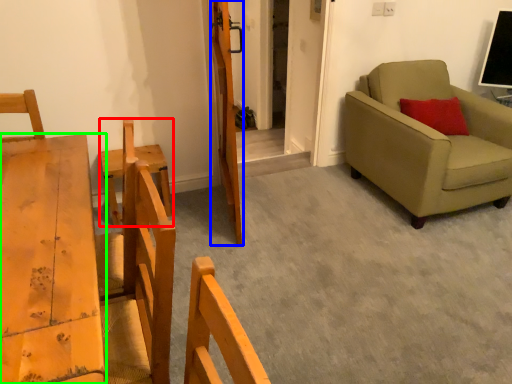
Question: Estimate the real-world distances between objects in this image. Which object is closer to armchair (highlighted by a red box), door (highlighted by a blue box) or furniture (highlighted by a green box)?

Choices:
 (A) door
 (B) furniture

Answer: (B)